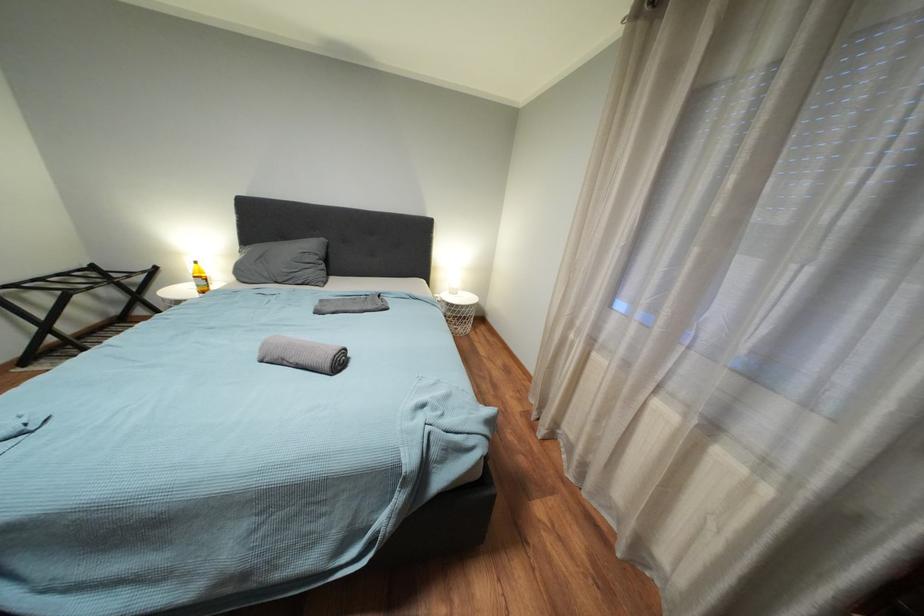
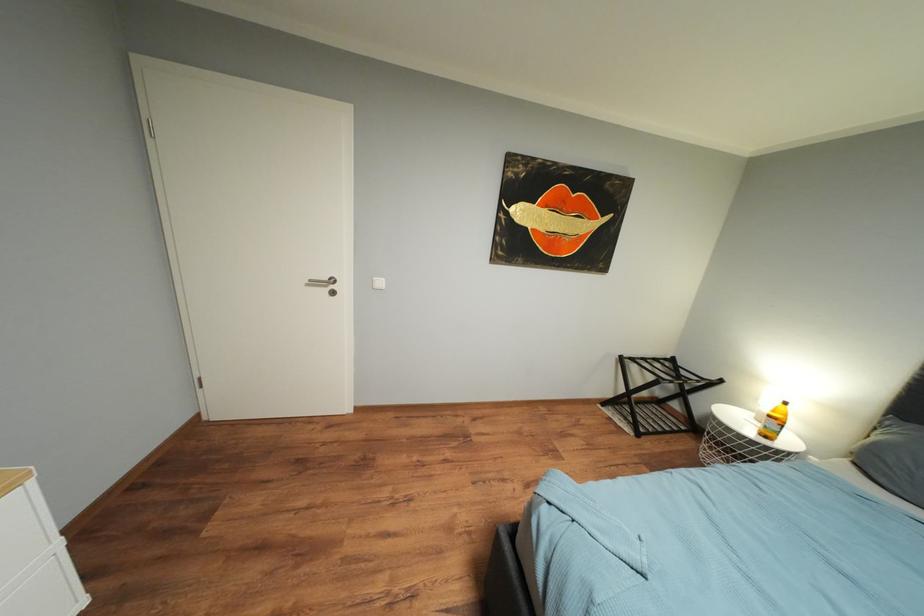
Question: The images are taken continuously from a first-person perspective. In which direction is your viewpoint rotating?

Choices:
 (A) Left
 (B) Right
 (C) Up
 (D) Down

Answer: (A)